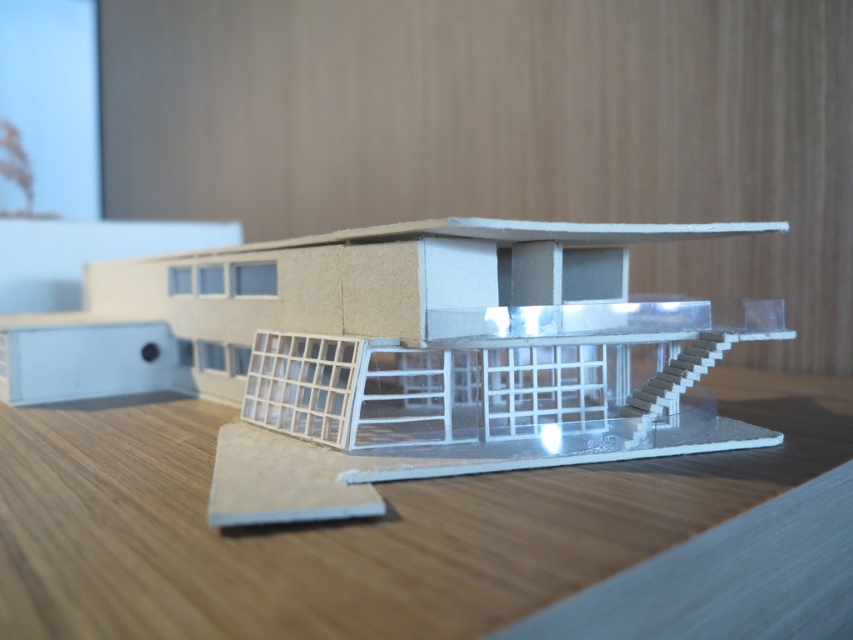
Between transparent plastic house at center and wooden table at center, which one appears on the left side from the viewer's perspective?

transparent plastic house at center

This screenshot has height=640, width=853. Describe the element at coordinates (398, 355) in the screenshot. I see `transparent plastic house at center` at that location.

Where is `transparent plastic house at center`? The width and height of the screenshot is (853, 640). transparent plastic house at center is located at coordinates (398, 355).